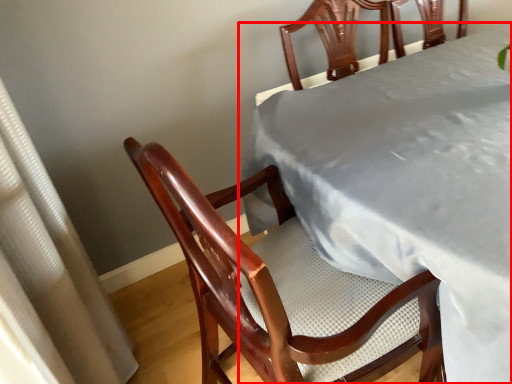
Question: From the image's perspective, considering the relative positions of table (annotated by the red box) and curtain in the image provided, where is table (annotated by the red box) located with respect to the staircase?

Choices:
 (A) above
 (B) below

Answer: (A)